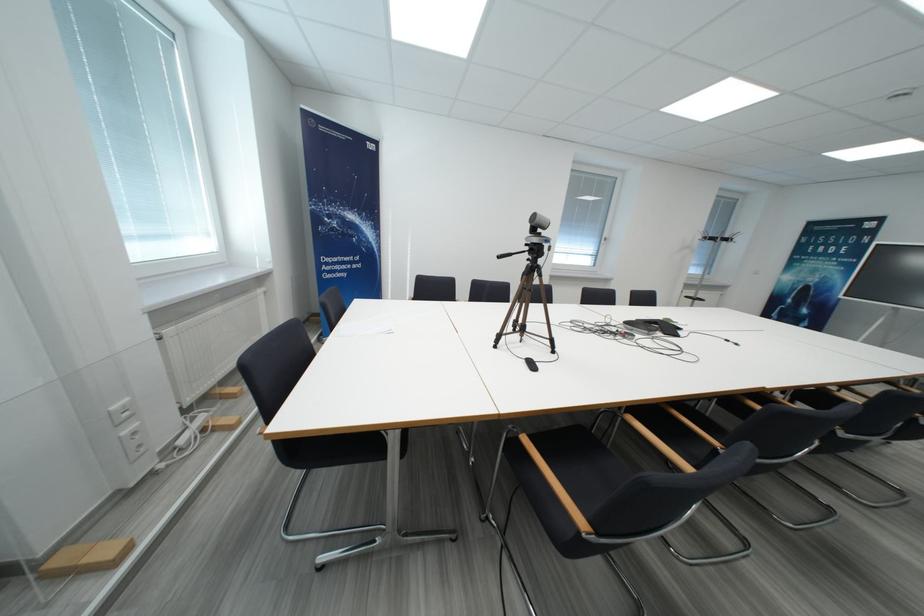
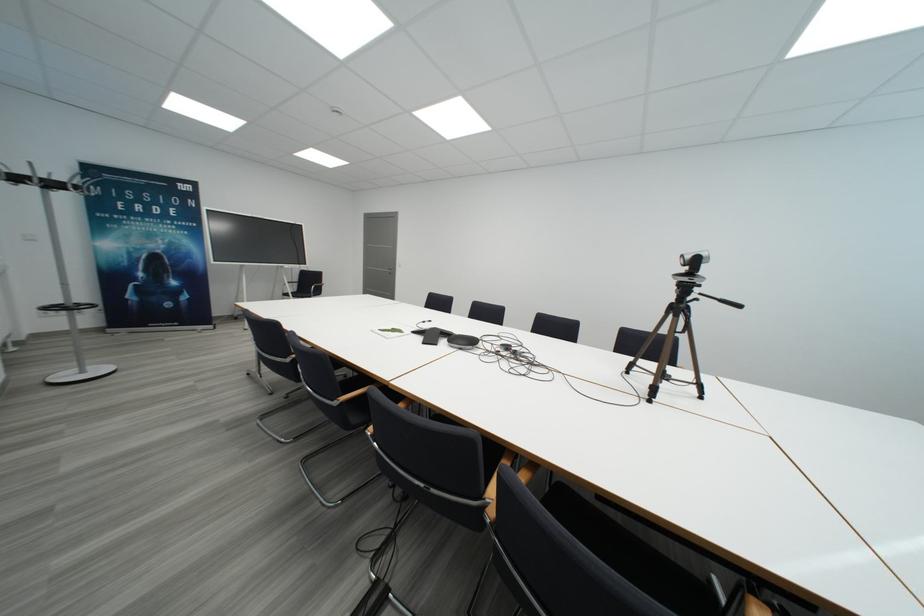
Question: I am providing you with two images of the same scene from different viewpoints. After the viewpoint changes to image2, which objects are now occluded?

Choices:
 (A) small white dish
 (B) tripod pan handle
 (C) black chair sitting surface
 (D) black conference speaker

Answer: (C)